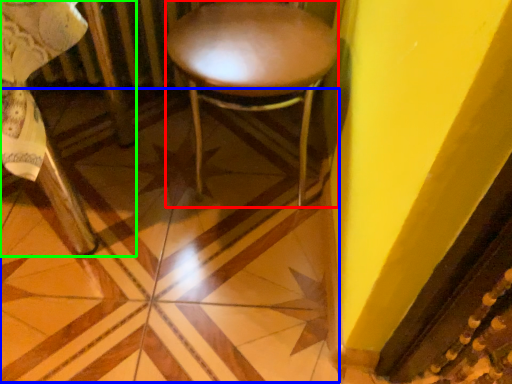
Question: Considering the real-world distances, which object is farthest from stool (highlighted by a red box)? tile (highlighted by a blue box) or chair (highlighted by a green box)?

Choices:
 (A) tile
 (B) chair

Answer: (B)